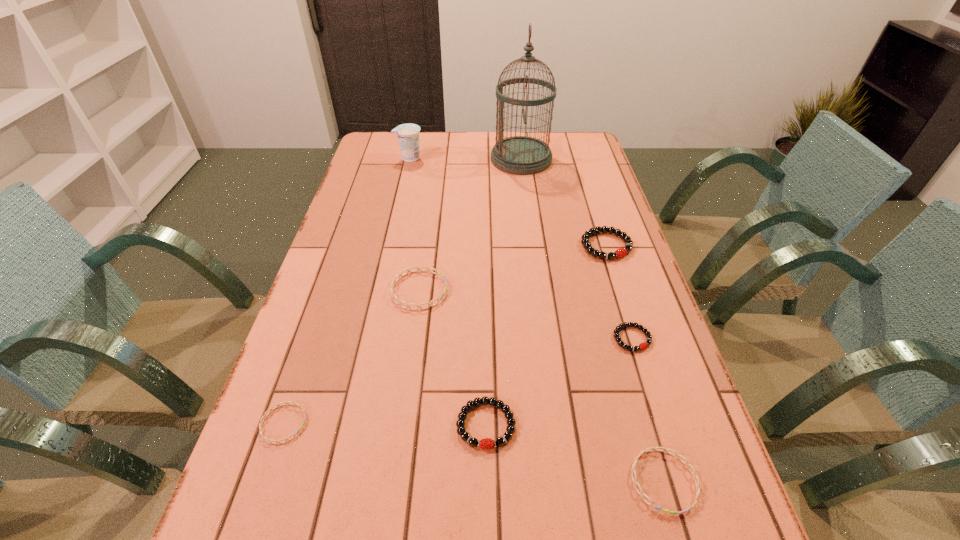
In order to click on the tallest object in this screenshot , I will do `click(521, 155)`.

Identify the location of yogurt. (408, 134).

Locate an element on the screen. Image resolution: width=960 pixels, height=540 pixels. blue yogurt is located at coordinates (408, 134).

The width and height of the screenshot is (960, 540). In order to click on the sixth nearest object in this screenshot , I will do `click(619, 253)`.

This screenshot has width=960, height=540. I want to click on the biggest black bracelet, so click(x=619, y=253).

At what (x,y) coordinates should I click in order to perform the action: click on the second blue bracelet from right to left. Please return your answer as a coordinate pair (x, y). Looking at the image, I should click on (394, 281).

Locate an element on the screen. The width and height of the screenshot is (960, 540). the biggest blue bracelet is located at coordinates click(x=394, y=281).

Image resolution: width=960 pixels, height=540 pixels. What are the coordinates of `the third bracelet from left to right` in the screenshot? It's located at (486, 443).

This screenshot has height=540, width=960. I want to click on the second smallest black bracelet, so click(486, 443).

Identify the location of the second smallest blue bracelet. (666, 450).